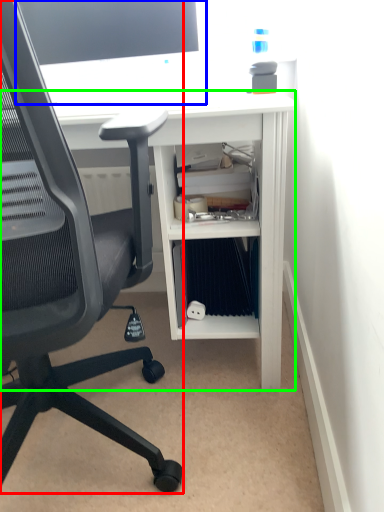
Question: Considering the real-world distances, which object is closest to chair (highlighted by a red box)? desktop computer (highlighted by a blue box) or desk (highlighted by a green box).

Choices:
 (A) desktop computer
 (B) desk

Answer: (B)